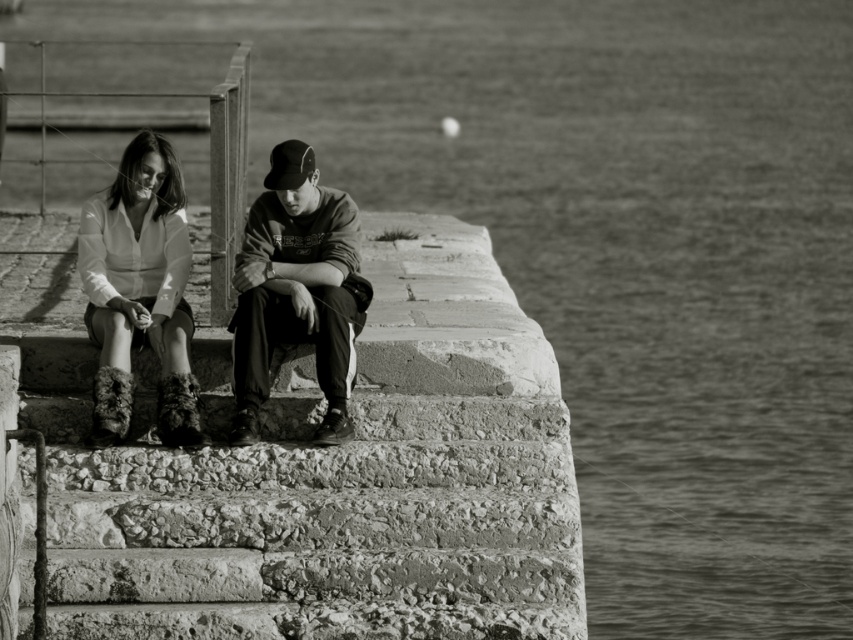
Question: Considering the real-world distances, which object is closest to the rough stone stairs at center?

Choices:
 (A) fuzzy fabric boots at lower left
 (B) dark gray sweatshirt at center

Answer: (B)

Question: Which point is closer to the camera?

Choices:
 (A) fuzzy fabric boots at lower left
 (B) dark gray sweatshirt at center
 (C) rough stone stairs at center
 (D) fluffy suede boots at lower left

Answer: (C)

Question: Considering the relative positions of rough stone stairs at center and fluffy suede boots at lower left in the image provided, where is rough stone stairs at center located with respect to fluffy suede boots at lower left?

Choices:
 (A) left
 (B) right

Answer: (A)

Question: Considering the relative positions of dark gray sweatshirt at center and fuzzy fabric boots at lower left in the image provided, where is dark gray sweatshirt at center located with respect to fuzzy fabric boots at lower left?

Choices:
 (A) below
 (B) above

Answer: (B)

Question: Can you confirm if rough stone stairs at center is positioned above fuzzy fabric boots at lower left?

Choices:
 (A) no
 (B) yes

Answer: (A)

Question: Which point is closer to the camera taking this photo?

Choices:
 (A) (241, 600)
 (B) (276, 314)

Answer: (A)